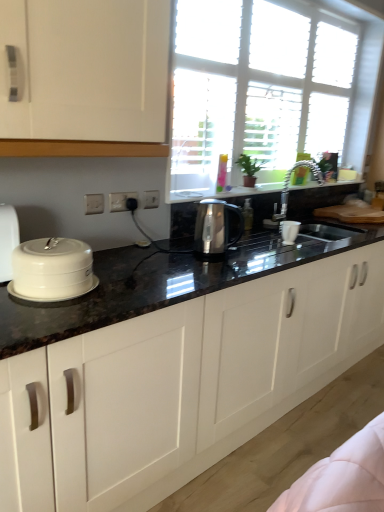
What do you see at coordinates (289, 181) in the screenshot? I see `metallic shiny faucet at upper center` at bounding box center [289, 181].

You are a GUI agent. You are given a task and a screenshot of the screen. Output one action in this format:
    pyautogui.click(x=<x>, y=<y>)
    Task: Click on the white ceramic lid at left
    
    Given the screenshot: What is the action you would take?
    pyautogui.click(x=52, y=270)

The image size is (384, 512). Describe the element at coordinates (180, 385) in the screenshot. I see `white glossy cabinets at center` at that location.

Where is `white glossy cabinets at center`? Image resolution: width=384 pixels, height=512 pixels. white glossy cabinets at center is located at coordinates (180, 385).

Looking at this image, measure the distance between transparent glass window at upper center and camera.

A distance of 6.77 feet exists between transparent glass window at upper center and camera.

Image resolution: width=384 pixels, height=512 pixels. I want to click on metallic shiny faucet at upper center, so click(289, 181).

Could you tell me if white glossy cabinets at center is facing white ceramic lid at left?

No, white glossy cabinets at center is not turned towards white ceramic lid at left.

From the picture: Who is smaller, white glossy cabinets at center or white ceramic lid at left?

A: white ceramic lid at left.

Is white glossy cabinets at center positioned far away from white ceramic lid at left?

No.

From the picture: From the image's perspective, relative to white ceramic lid at left, is white glossy cabinets at center above or below?

Based on their image positions, white glossy cabinets at center is located beneath white ceramic lid at left.

Considering the positions of point (94, 210) and point (270, 288), is point (94, 210) closer or farther from the camera than point (270, 288)?

Point (94, 210) appears to be closer to the viewer than point (270, 288).

How distant is white plastic electric outlet at center, the 3th electric outlet viewed from the back, from white glossy cabinets at center?

36.51 inches.

Is white plastic electric outlet at center, which is the third electric outlet in right-to-left order, positioned with its back to white glossy cabinets at center?

No, white plastic electric outlet at center, which is the third electric outlet in right-to-left order, is not facing the opposite direction of white glossy cabinets at center.

Would you say white plastic electric outlet at center, the 3th electric outlet viewed from the back, is inside or outside white glossy cabinets at center?

white plastic electric outlet at center, the 3th electric outlet viewed from the back, is spatially situated outside white glossy cabinets at center.

Are white glossy cabinets at center and white plastic electric outlet at center, marked as the first electric outlet in a back-to-front arrangement, far apart?

white glossy cabinets at center is actually quite close to white plastic electric outlet at center, marked as the first electric outlet in a back-to-front arrangement.

Is white glossy cabinets at center positioned with its back to white plastic electric outlet at center, which appears as the 3th electric outlet when viewed from the front?

white glossy cabinets at center does not have its back to white plastic electric outlet at center, which appears as the 3th electric outlet when viewed from the front.

Who is bigger, white glossy cabinets at center or white plastic electric outlet at center, marked as the first electric outlet in a back-to-front arrangement?

white glossy cabinets at center is bigger.

Which is correct: satin metallic kettle at center is inside white glossy cabinets at center, or outside of it?

satin metallic kettle at center lies outside white glossy cabinets at center.

Between satin metallic kettle at center and white glossy cabinets at center, which one appears on the right side from the viewer's perspective?

From the viewer's perspective, white glossy cabinets at center appears more on the right side.

Who is bigger, satin metallic kettle at center or white glossy cabinets at center?

white glossy cabinets at center is bigger.

Is satin metallic kettle at center oriented towards white glossy cabinets at center?

No, satin metallic kettle at center is not oriented towards white glossy cabinets at center.

Between white glossy cabinets at center and metallic shiny faucet at upper center, which one is positioned in front?

white glossy cabinets at center is more forward.

Based on the photo, between white glossy cabinets at center and metallic shiny faucet at upper center, which one has smaller width?

With smaller width is metallic shiny faucet at upper center.

From a real-world perspective, relative to metallic shiny faucet at upper center, is white glossy cabinets at center vertically above or below?

Clearly, from a real-world perspective, white glossy cabinets at center is below metallic shiny faucet at upper center.

Is white glossy cabinets at center taller or shorter than metallic shiny faucet at upper center?

In the image, white glossy cabinets at center appears to be taller than metallic shiny faucet at upper center.

You are a GUI agent. You are given a task and a screenshot of the screen. Output one action in this format:
    pyautogui.click(x=<x>, y=<y>)
    Task: Click on the 2nd electric outlet located above the white plastic electric outlet at center, which ranks as the 2th electric outlet in back-to-front order (from a real-world perspective)
    
    Given the screenshot: What is the action you would take?
    pyautogui.click(x=93, y=204)

Is white plastic electric outlet at center, which ranks as the 2th electric outlet in back-to-front order, shorter than white plastic electric outlet at center, positioned as the first electric outlet in left-to-right order?

No, white plastic electric outlet at center, which ranks as the 2th electric outlet in back-to-front order, is not shorter than white plastic electric outlet at center, positioned as the first electric outlet in left-to-right order.

Is white plastic electric outlet at center, which ranks as the 2th electric outlet in front-to-back order, bigger or smaller than white plastic electric outlet at center, positioned as the first electric outlet in left-to-right order?

white plastic electric outlet at center, which ranks as the 2th electric outlet in front-to-back order, is bigger than white plastic electric outlet at center, positioned as the first electric outlet in left-to-right order.

From a real-world perspective, which object stands above the other?

white plastic electric outlet at center, the 2th electric outlet positioned from the right.

Visually, is white plastic electric outlet at center, which ranks as the 2th electric outlet in front-to-back order, positioned to the left or to the right of metallic shiny faucet at upper center?

From the image, it's evident that white plastic electric outlet at center, which ranks as the 2th electric outlet in front-to-back order, is to the left of metallic shiny faucet at upper center.

In the image, is white plastic electric outlet at center, which ranks as the 2th electric outlet in front-to-back order, positioned in front of or behind metallic shiny faucet at upper center?

white plastic electric outlet at center, which ranks as the 2th electric outlet in front-to-back order, is positioned closer to the viewer than metallic shiny faucet at upper center.

Can you confirm if white plastic electric outlet at center, which is the 2th electric outlet in left-to-right order, is wider than metallic shiny faucet at upper center?

In fact, white plastic electric outlet at center, which is the 2th electric outlet in left-to-right order, might be narrower than metallic shiny faucet at upper center.

Find the location of a particular element. This screenshot has height=512, width=384. home appliance to the left of white glossy cabinets at center is located at coordinates (52, 270).

Locate an element on the screen. The image size is (384, 512). electric outlet that is the 1st one when counting backward from the white glossy cabinets at center is located at coordinates (93, 204).

When comparing their distances from white plastic electric outlet at center, which is the 2th electric outlet in left-to-right order, does satin metallic kettle at center or white plastic electric outlet at center, positioned as the first electric outlet in left-to-right order, seem further?

satin metallic kettle at center lies further to white plastic electric outlet at center, which is the 2th electric outlet in left-to-right order, than the other object.

Which object lies nearer to the anchor point white plastic electric outlet at center, which ranks as the 1th electric outlet in front-to-back order, metallic shiny faucet at upper center or white ceramic lid at left?

Among the two, white ceramic lid at left is located nearer to white plastic electric outlet at center, which ranks as the 1th electric outlet in front-to-back order.

Estimate the real-world distances between objects in this image. Which object is further from transparent glass window at upper center, white ceramic lid at left or white plastic electric outlet at center, which is the 2th electric outlet in left-to-right order?

white ceramic lid at left.

Estimate the real-world distances between objects in this image. Which object is further from white plastic electric outlet at center, positioned as the 1th electric outlet in right-to-left order, metallic shiny faucet at upper center or white glossy cabinets at center?

metallic shiny faucet at upper center.

From the image, which object appears to be farther from white plastic electric outlet at center, which ranks as the 2th electric outlet in back-to-front order, white plastic electric outlet at center, which ranks as the 1th electric outlet in front-to-back order, or white glossy cabinets at center?

Among the two, white glossy cabinets at center is located further to white plastic electric outlet at center, which ranks as the 2th electric outlet in back-to-front order.

Considering their positions, is white ceramic lid at left positioned further to white plastic electric outlet at center, which ranks as the 2th electric outlet in front-to-back order, than satin metallic kettle at center?

white ceramic lid at left.

When comparing their distances from white plastic electric outlet at center, marked as the first electric outlet in a back-to-front arrangement, does white plastic electric outlet at center, which is the 2th electric outlet in left-to-right order, or white ceramic lid at left seem closer?

The object closer to white plastic electric outlet at center, marked as the first electric outlet in a back-to-front arrangement, is white plastic electric outlet at center, which is the 2th electric outlet in left-to-right order.

Based on the photo, considering their positions, is white plastic electric outlet at center, which is the third electric outlet in right-to-left order, positioned closer to white plastic electric outlet at center, the third electric outlet in the left-to-right sequence, than satin metallic kettle at center?

The object closer to white plastic electric outlet at center, the third electric outlet in the left-to-right sequence, is white plastic electric outlet at center, which is the third electric outlet in right-to-left order.

What are the coordinates of `kitchen appliance between white glossy cabinets at center and white plastic electric outlet at center, the third electric outlet in the left-to-right sequence, along the z-axis` in the screenshot? It's located at pyautogui.click(x=215, y=227).

Image resolution: width=384 pixels, height=512 pixels. What are the coordinates of `kitchen appliance between white ceramic lid at left and metallic shiny faucet at upper center` in the screenshot? It's located at (215, 227).

Where is `electric outlet between transparent glass window at upper center and white plastic electric outlet at center, which ranks as the 2th electric outlet in back-to-front order, from top to bottom`? The image size is (384, 512). electric outlet between transparent glass window at upper center and white plastic electric outlet at center, which ranks as the 2th electric outlet in back-to-front order, from top to bottom is located at coordinates point(151,199).

You are a GUI agent. You are given a task and a screenshot of the screen. Output one action in this format:
    pyautogui.click(x=<x>, y=<y>)
    Task: Click on the home appliance between white glossy cabinets at center and metallic shiny faucet at upper center along the z-axis
    This screenshot has height=512, width=384.
    Given the screenshot: What is the action you would take?
    pyautogui.click(x=52, y=270)